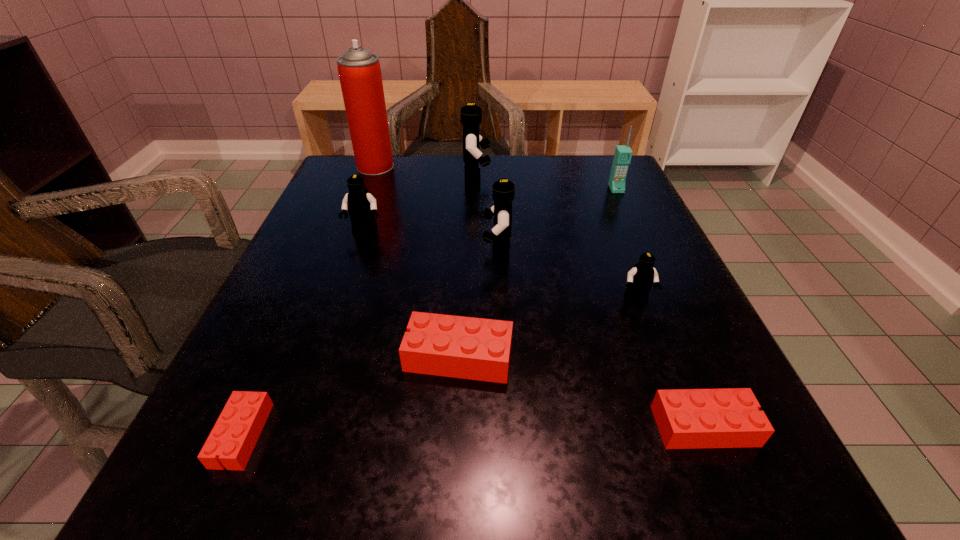
Find the location of a particular element. The height and width of the screenshot is (540, 960). free space located 0.350m on the front-facing side of the third smallest black Lego is located at coordinates (x=300, y=251).

Identify the location of free point located on the keypad of the cellular telephone. This screenshot has height=540, width=960. (630, 218).

The image size is (960, 540). In order to click on free region located on the front-facing side of the second Lego from left to right in this screenshot , I will do `click(321, 357)`.

Where is `free space located 0.210m on the front-facing side of the sixth farthest object`? This screenshot has height=540, width=960. free space located 0.210m on the front-facing side of the sixth farthest object is located at coordinates (684, 419).

Where is `free space located 0.230m on the right of the seventh tallest object`? This screenshot has width=960, height=540. free space located 0.230m on the right of the seventh tallest object is located at coordinates (668, 357).

The image size is (960, 540). In order to click on free space located on the back of the second smallest red Lego in this screenshot , I will do `click(625, 238)`.

Where is `blank space located on the right of the shortest object`? Image resolution: width=960 pixels, height=540 pixels. blank space located on the right of the shortest object is located at coordinates (522, 435).

Where is `aerosol can present at the far edge`? This screenshot has width=960, height=540. aerosol can present at the far edge is located at coordinates (359, 71).

This screenshot has height=540, width=960. Find the location of `Lego located in the far edge section of the desktop`. Lego located in the far edge section of the desktop is located at coordinates tap(471, 115).

The height and width of the screenshot is (540, 960). Find the location of `cellular telephone located in the far edge section of the desktop`. cellular telephone located in the far edge section of the desktop is located at coordinates (622, 157).